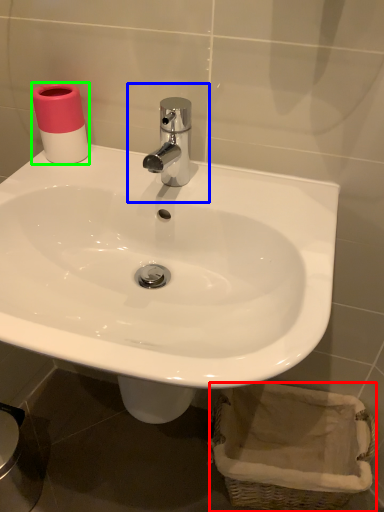
Question: Based on their relative distances, which object is farther from basket (highlighted by a red box)? Choose from plumbing fixture (highlighted by a blue box) and toilet paper (highlighted by a green box).

Choices:
 (A) plumbing fixture
 (B) toilet paper

Answer: (B)